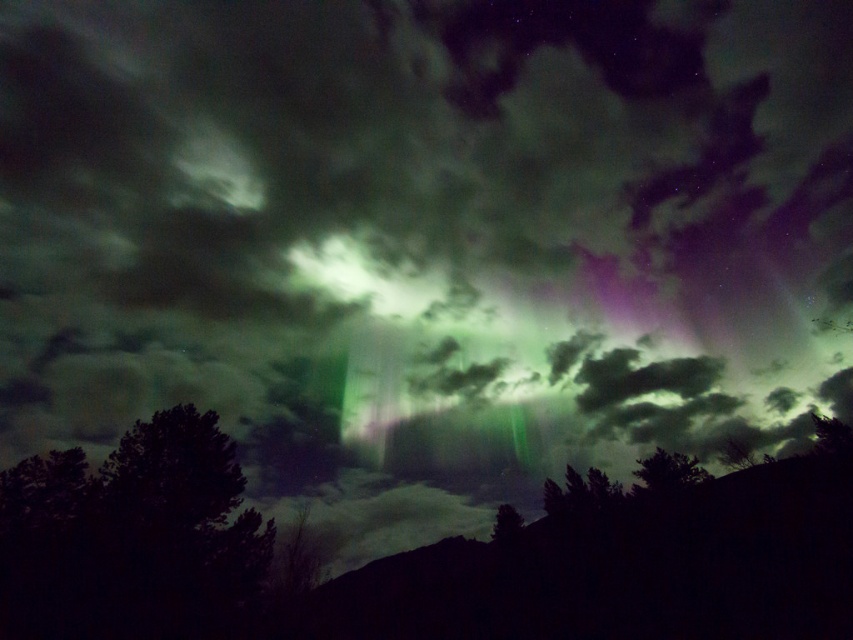
You are an astronomer observing the aurora borealis in the image. You notice a point at coordinates (131, 538). Based on the scene, what object does this point belong to?

The point at coordinates (131, 538) is on the dark green leafy tree at lower left.

You are an astronomer observing the aurora borealis. You notice two trees in the foreground. Which tree, the dark green leafy tree at lower left or the green leafy tree at lower center, is taller?

The dark green leafy tree at lower left is taller than the green leafy tree at lower center.